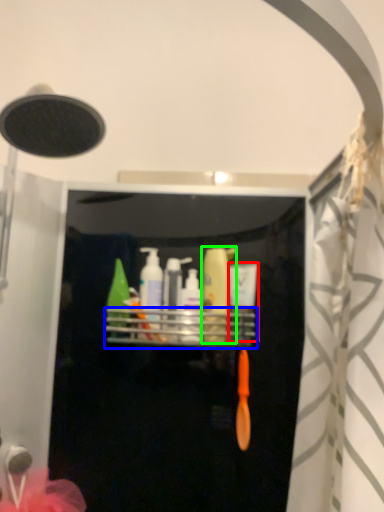
Question: Which object is positioned closest to toiletry (highlighted by a red box)? Select from shelf (highlighted by a blue box) and toiletry (highlighted by a green box).

Choices:
 (A) shelf
 (B) toiletry

Answer: (B)